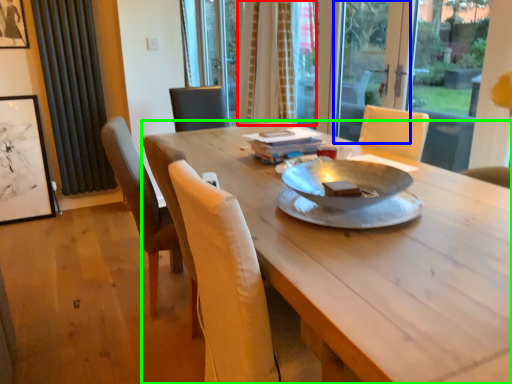
Question: Considering the real-world distances, which object is closest to curtain (highlighted by a red box)? screen door (highlighted by a blue box) or desk (highlighted by a green box).

Choices:
 (A) screen door
 (B) desk

Answer: (A)